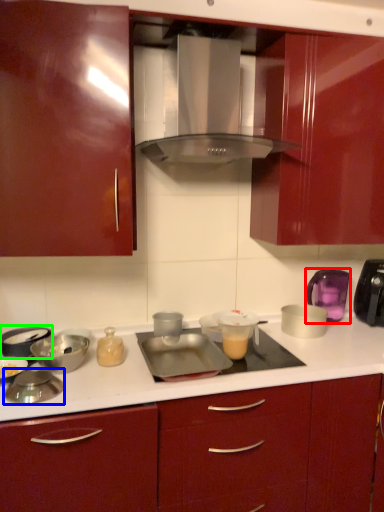
Question: Which is nearer to the kitchen appliance (highlighted by a red box)? appliance (highlighted by a blue box) or appliance (highlighted by a green box).

Choices:
 (A) appliance
 (B) appliance

Answer: (B)